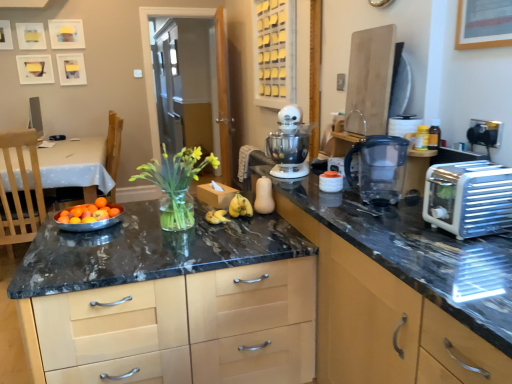
I want to click on vacant area on top of matte black countertop at center, positioned as the 3th cabinetry in top-to-bottom order (from a real-world perspective), so click(x=159, y=225).